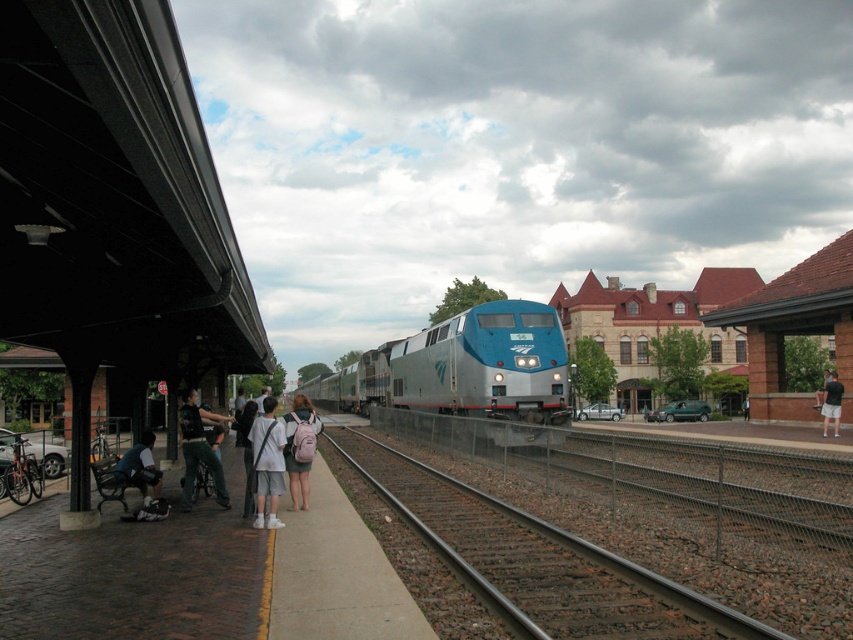
Measure the distance between dark blue jeans at lower left and black shorts at right.

They are 23.74 meters apart.

Who is more distant from viewer, (141, 451) or (830, 403)?

The point (830, 403) is behind.

Is point (152, 458) in front of point (836, 417)?

Yes, it is in front of point (836, 417).

Where is `dark blue jeans at lower left`? dark blue jeans at lower left is located at coordinates (140, 468).

Between dark gray backpack at center and dark blue jeans at lower left, which one has less height?

With less height is dark blue jeans at lower left.

Does dark gray backpack at center have a greater width compared to dark blue jeans at lower left?

Indeed, dark gray backpack at center has a greater width compared to dark blue jeans at lower left.

Find the location of a particular element. The width and height of the screenshot is (853, 640). dark gray backpack at center is located at coordinates (199, 449).

Does dark gray backpack at center have a greater height compared to black shorts at right?

Yes.

Between point (189, 408) and point (834, 381), which one is positioned behind?

The point (834, 381) is more distant.

Identify the location of dark gray backpack at center. The height and width of the screenshot is (640, 853). click(199, 449).